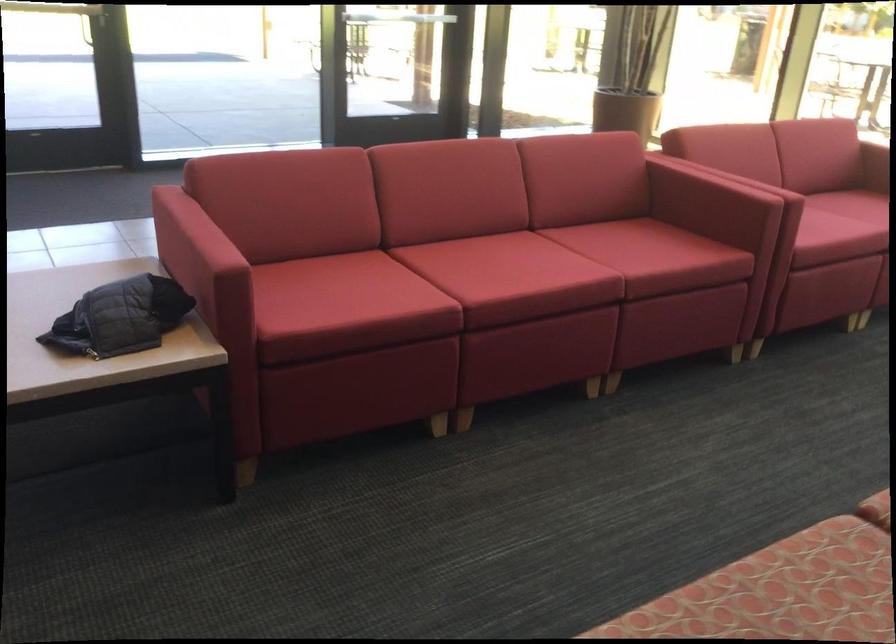
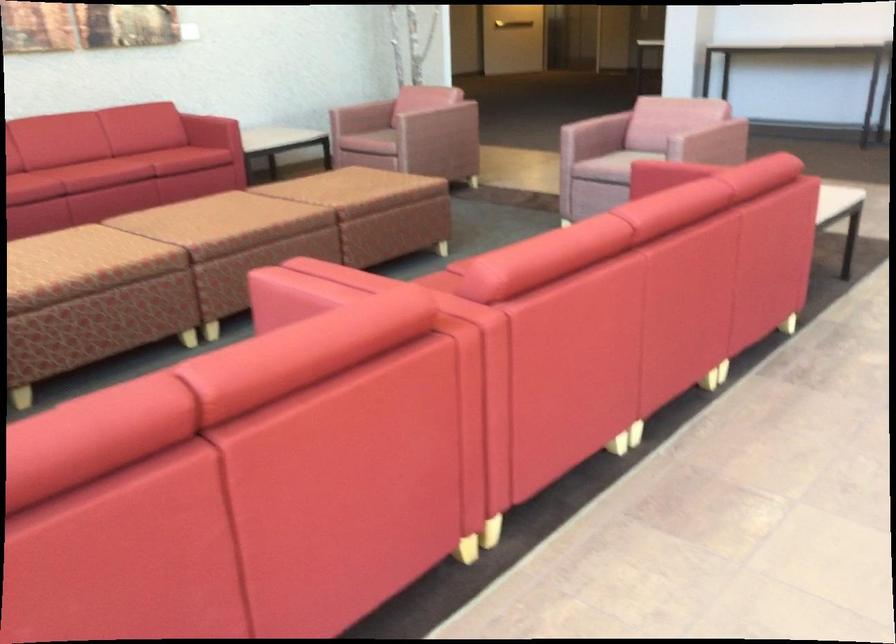
The point at (784, 162) is marked in the first image. Where is the corresponding point in the second image?

(112, 574)